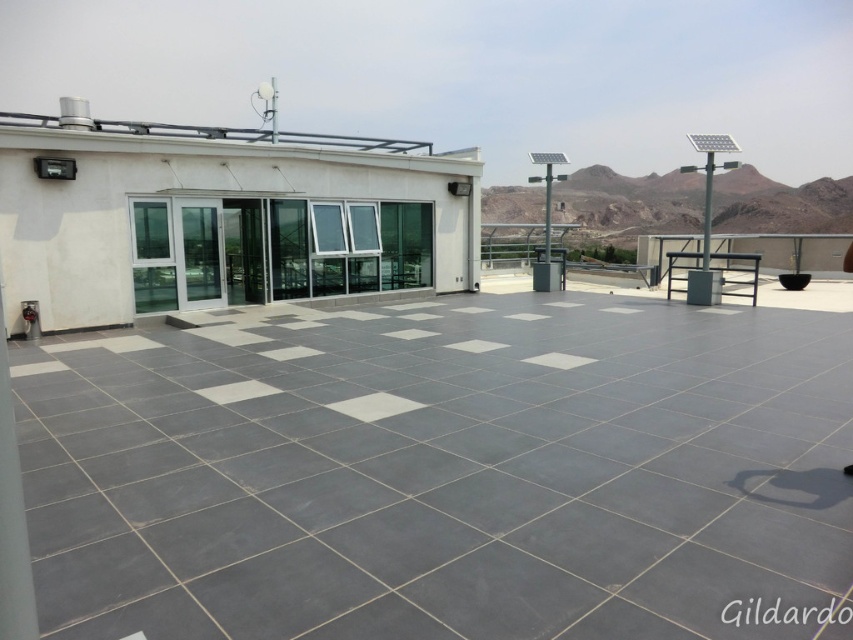
You are standing on the rooftop terrace and want to place a small potted plant exactly at the point marked by coordinates point [442,468]. What will the plant be placed on?

The point [442,468] corresponds to the gray tile at center, so the plant will be placed on the gray tile at center.

You are standing on the rooftop terrace and want to place a small potted plant exactly at the center of the gray tile at center. To do this, you need to know the exact coordinates. What are the coordinates where you should place the potted plant?

The coordinates for the gray tile at center are at point (442, 468). Therefore, you should place the potted plant at coordinates 0.734 and 0.519.